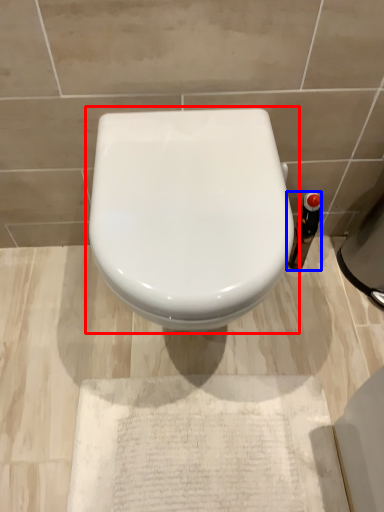
Question: Which object is further to the camera taking this photo, toilet (highlighted by a red box) or bottle (highlighted by a blue box)?

Choices:
 (A) toilet
 (B) bottle

Answer: (B)